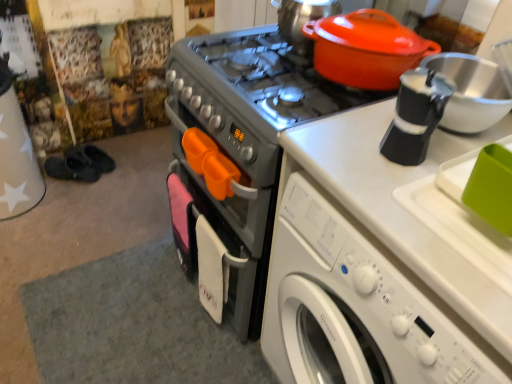
Find the location of a particular element. Image resolution: width=512 pixels, height=384 pixels. vacant region to the left of matte orange tea pot at upper right is located at coordinates (254, 52).